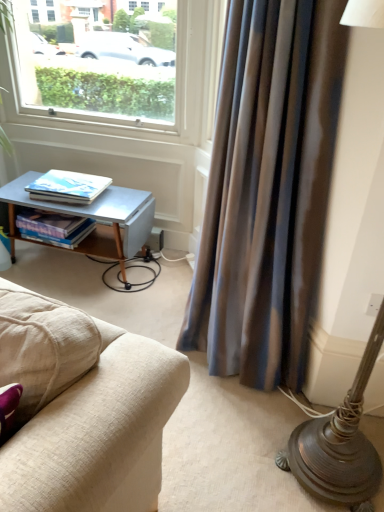
Question: From a real-world perspective, is white plastic window at upper left under matte white book at left, which appears as the 1th book when viewed from the top?

Choices:
 (A) yes
 (B) no

Answer: (B)

Question: Is white plastic window at upper left not inside matte white book at left, which appears as the 1th book when viewed from the top?

Choices:
 (A) no
 (B) yes

Answer: (B)

Question: Is matte white book at left, which appears as the 1th book when viewed from the top, surrounded by white plastic window at upper left?

Choices:
 (A) no
 (B) yes

Answer: (A)

Question: Is white plastic window at upper left to the right of matte white book at left, which appears as the 1th book when viewed from the top, from the viewer's perspective?

Choices:
 (A) yes
 (B) no

Answer: (A)

Question: From a real-world perspective, is white plastic window at upper left located higher than matte white book at left, which appears as the 1th book when viewed from the top?

Choices:
 (A) yes
 (B) no

Answer: (A)

Question: Is hardcover books at lower left, which appears as the 1th book when ordered from the bottom, bigger or smaller than matte white book at left, which appears as the 1th book when viewed from the top?

Choices:
 (A) small
 (B) big

Answer: (B)

Question: From the image's perspective, is hardcover books at lower left, which appears as the 1th book when ordered from the bottom, above or below matte white book at left, which appears as the 1th book when viewed from the top?

Choices:
 (A) below
 (B) above

Answer: (A)

Question: In the image, is hardcover books at lower left, which appears as the 1th book when ordered from the bottom, on the left side or the right side of matte white book at left, which appears as the 1th book when viewed from the top?

Choices:
 (A) left
 (B) right

Answer: (A)

Question: Is hardcover books at lower left, which is counted as the second book, starting from the top, wider or thinner than matte white book at left, which is counted as the second book, starting from the bottom?

Choices:
 (A) thin
 (B) wide

Answer: (A)

Question: From a real-world perspective, is white plastic window at upper left physically located above or below matte white book at left, which appears as the 1th book when viewed from the top?

Choices:
 (A) below
 (B) above

Answer: (B)

Question: Is white plastic window at upper left taller or shorter than matte white book at left, which appears as the 1th book when viewed from the top?

Choices:
 (A) short
 (B) tall

Answer: (B)

Question: Considering the positions of white plastic window at upper left and matte white book at left, which appears as the 1th book when viewed from the top, in the image, is white plastic window at upper left wider or thinner than matte white book at left, which appears as the 1th book when viewed from the top,?

Choices:
 (A) wide
 (B) thin

Answer: (B)

Question: Is white plastic window at upper left spatially inside matte white book at left, which is counted as the second book, starting from the bottom, or outside of it?

Choices:
 (A) outside
 (B) inside

Answer: (A)

Question: Looking at their shapes, would you say hardcover books at lower left, which is counted as the second book, starting from the top, is wider or thinner than silky blue curtain at right?

Choices:
 (A) wide
 (B) thin

Answer: (B)

Question: From the image's perspective, is hardcover books at lower left, which appears as the 1th book when ordered from the bottom, positioned above or below silky blue curtain at right?

Choices:
 (A) below
 (B) above

Answer: (B)